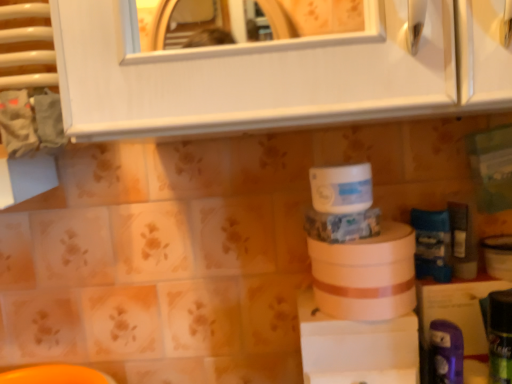
Question: From the image's perspective, relative to white matte toilet paper at center, acting as the 1th toilet paper starting from the bottom, is purple plastic toothbrush at lower right, the 3th toiletry viewed from the back, above or below?

Choices:
 (A) above
 (B) below

Answer: (B)

Question: Considering the relative positions of purple plastic toothbrush at lower right, the 3th toiletry viewed from the back, and white matte toilet paper at center, which is counted as the second toilet paper, starting from the top, in the image provided, is purple plastic toothbrush at lower right, the 3th toiletry viewed from the back, to the left or to the right of white matte toilet paper at center, which is counted as the second toilet paper, starting from the top,?

Choices:
 (A) left
 (B) right

Answer: (B)

Question: Which object is the closest to the white matte toilet paper at center, acting as the 1th toilet paper starting from the bottom?

Choices:
 (A) green matte can at lower right, the first toiletry viewed from the front
 (B) white matte jar at center, the 2th toilet paper positioned from the bottom
 (C) blue plastic tube at right, placed as the third toiletry when sorted from front to back
 (D) blue matte toothpaste tube at right, which ranks as the fourth toiletry in front-to-back order
 (E) purple plastic toothbrush at lower right, which appears as the 2th toiletry when viewed from the front

Answer: (B)

Question: Based on their relative distances, which object is nearer to the green matte can at lower right, the 4th toiletry from the back?

Choices:
 (A) white matte jar at center, the first toilet paper viewed from the top
 (B) blue matte toothpaste tube at right, which ranks as the fourth toiletry in front-to-back order
 (C) white matte toilet paper at center, acting as the 1th toilet paper starting from the bottom
 (D) blue plastic tube at right, which is counted as the 2th toiletry, starting from the back
 (E) purple plastic toothbrush at lower right, the 3th toiletry viewed from the back

Answer: (E)